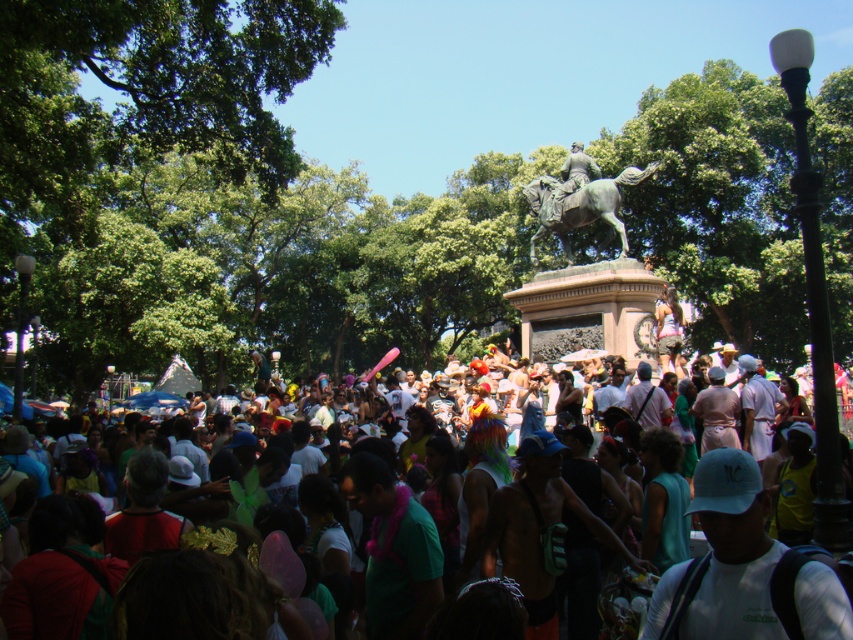
Who is positioned more to the left, bronze polished horse at center or bronze statue at upper center?

bronze polished horse at center

Does bronze polished horse at center have a greater height compared to bronze statue at upper center?

Incorrect, bronze polished horse at center's height is not larger of bronze statue at upper center's.

I want to click on bronze polished horse at center, so click(581, 208).

Find the location of a particular element. This screenshot has height=640, width=853. bronze polished horse at center is located at coordinates (581, 208).

Does point (816, 586) come farther from viewer compared to point (612, 212)?

No.

Can you confirm if multicolored costumes at center is thinner than bronze polished horse at center?

In fact, multicolored costumes at center might be wider than bronze polished horse at center.

Which is in front, point (744, 541) or point (599, 211)?

Point (744, 541)

Identify the location of multicolored costumes at center. This screenshot has height=640, width=853. (744, 568).

Can you confirm if multicolored costumes at center is positioned below bronze statue at upper center?

Yes.

Is multicolored costumes at center wider than bronze statue at upper center?

Indeed, multicolored costumes at center has a greater width compared to bronze statue at upper center.

Locate an element on the screen. The image size is (853, 640). multicolored costumes at center is located at coordinates pyautogui.click(x=744, y=568).